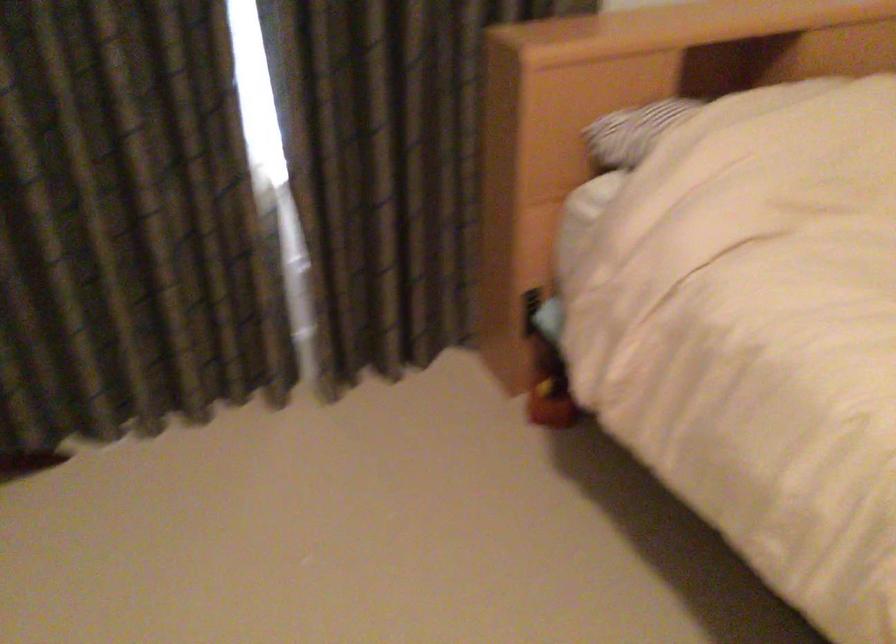
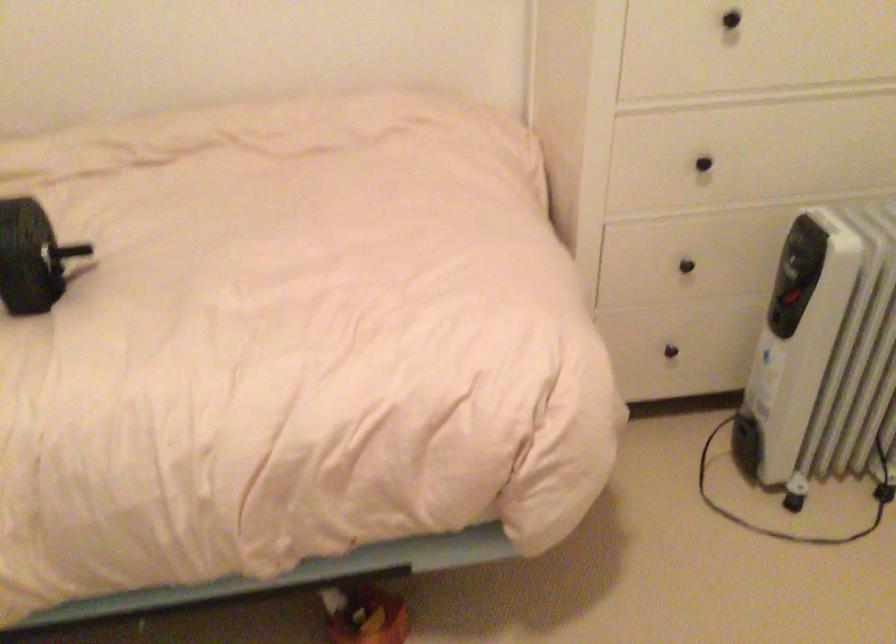
How did the camera likely rotate?

The camera's rotation is toward right-down.